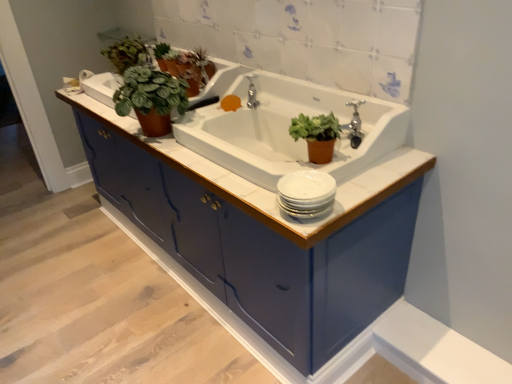
Question: Considering the positions of point pyautogui.click(x=193, y=61) and point pyautogui.click(x=302, y=114), is point pyautogui.click(x=193, y=61) closer or farther from the camera than point pyautogui.click(x=302, y=114)?

Choices:
 (A) closer
 (B) farther

Answer: (B)

Question: From the image's perspective, is green matte plant at upper center located above or below matte brown pot at center, which is the 3th houseplant from left to right?

Choices:
 (A) below
 (B) above

Answer: (B)

Question: Estimate the real-world distances between objects in this image. Which object is closer to the silver metallic tap at upper center?

Choices:
 (A) green matte plant at upper left, the 2th houseplant positioned from the front
 (B) white glossy sink at center
 (C) matte ceramic sink at center
 (D) green matte plant at upper center
 (E) green matte plant at upper left, the first houseplant in the top-to-bottom sequence

Answer: (D)

Question: Which object is the farthest from the green matte plant at upper center?

Choices:
 (A) matte blue cabinet at center
 (B) silver metallic tap at upper center
 (C) white glossy sink at center
 (D) green matte plant at upper left, which is counted as the 3th houseplant, starting from the front
 (E) matte ceramic sink at center

Answer: (A)